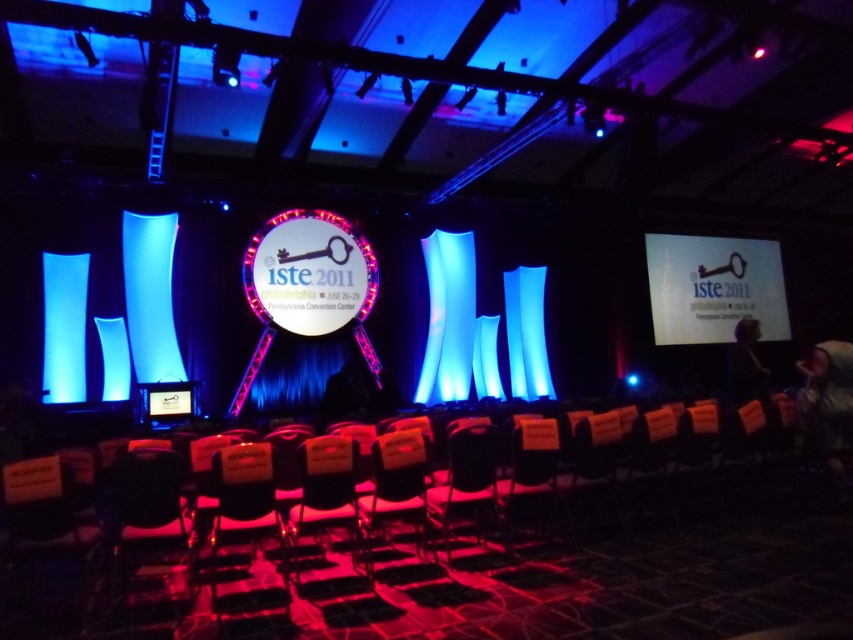
Can you confirm if white matte projection screen at upper center is taller than black plastic chair at center?

Yes, white matte projection screen at upper center is taller than black plastic chair at center.

Between white matte projection screen at upper center and black plastic chair at center, which one appears on the right side from the viewer's perspective?

white matte projection screen at upper center

Identify the location of white matte projection screen at upper center. This screenshot has width=853, height=640. (714, 288).

Can you confirm if white matte projection screen at upper center is thinner than orange fabric chair at center?

No.

Between white matte projection screen at upper center and orange fabric chair at center, which one appears on the right side from the viewer's perspective?

white matte projection screen at upper center

Which is behind, point (714, 262) or point (410, 461)?

Positioned behind is point (714, 262).

Locate an element on the screen. The width and height of the screenshot is (853, 640). white matte projection screen at upper center is located at coordinates (714, 288).

Is orange fabric chair at center above black plastic chair at center?

Incorrect, orange fabric chair at center is not positioned above black plastic chair at center.

Image resolution: width=853 pixels, height=640 pixels. Describe the element at coordinates (397, 484) in the screenshot. I see `orange fabric chair at center` at that location.

Locate an element on the screen. Image resolution: width=853 pixels, height=640 pixels. orange fabric chair at center is located at coordinates (397, 484).